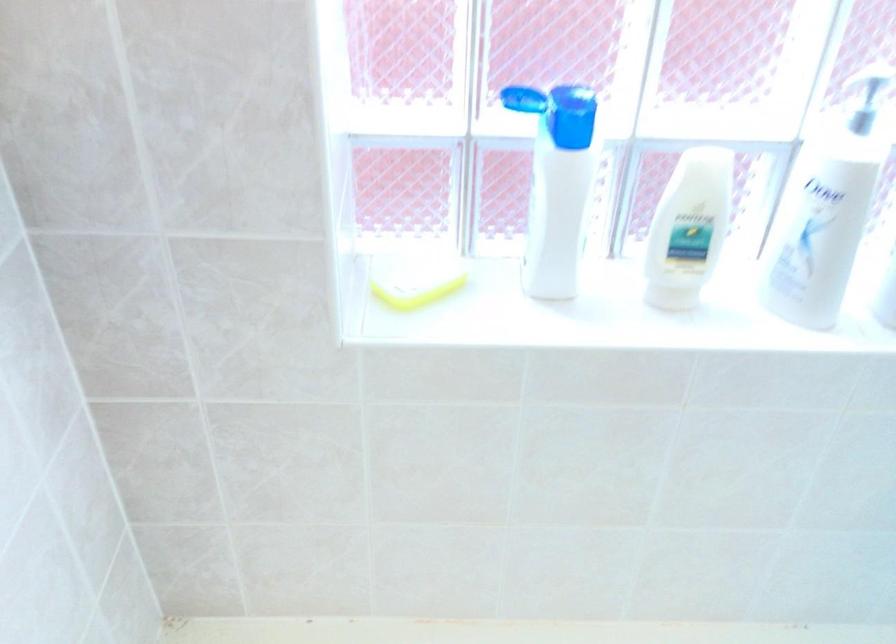
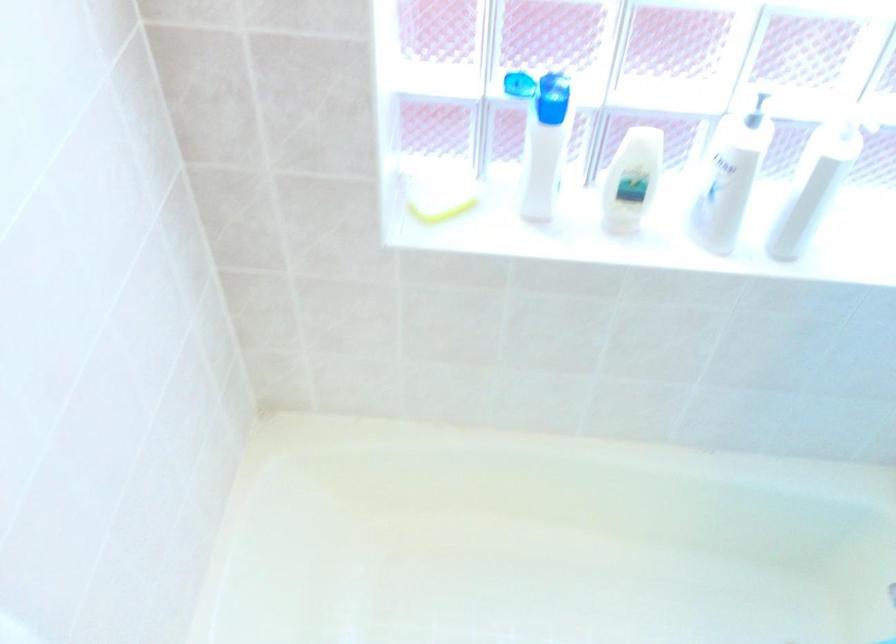
In the second image, find the point that corresponds to [410,277] in the first image.

(438, 196)